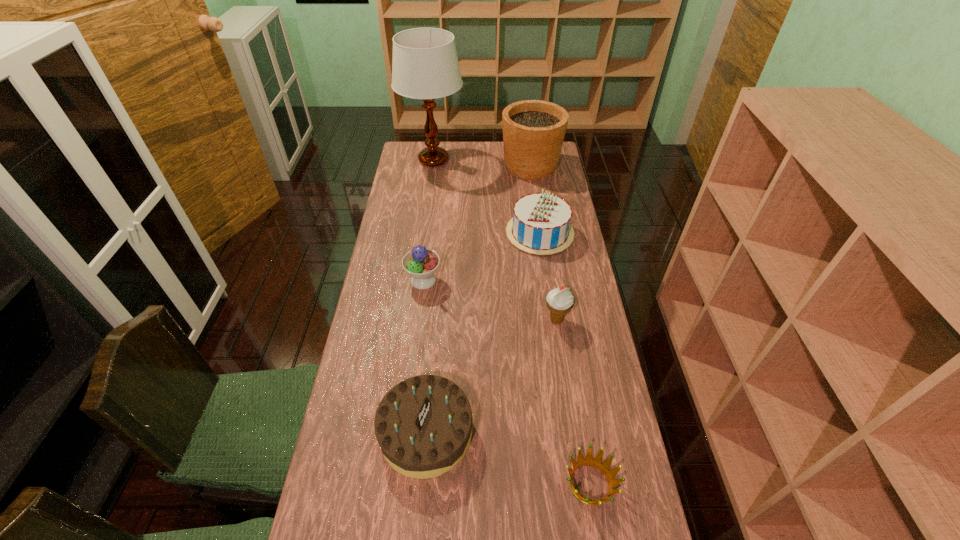
The height and width of the screenshot is (540, 960). I want to click on the shortest object, so click(x=596, y=462).

The height and width of the screenshot is (540, 960). Find the location of `blank area located 0.360m on the right of the tallest object`. blank area located 0.360m on the right of the tallest object is located at coordinates (540, 160).

This screenshot has height=540, width=960. What are the coordinates of `free space located 0.400m on the front of the second tallest object` in the screenshot? It's located at (541, 244).

Locate an element on the screen. The width and height of the screenshot is (960, 540). free space located on the front of the nearer icecream is located at coordinates (562, 352).

You are a GUI agent. You are given a task and a screenshot of the screen. Output one action in this format:
    pyautogui.click(x=<x>, y=<y>)
    Task: Click on the vacant area situated on the front of the left icecream
    
    Given the screenshot: What is the action you would take?
    pyautogui.click(x=416, y=345)

Image resolution: width=960 pixels, height=540 pixels. What are the coordinates of `free region located 0.280m on the back of the right birthday cake` in the screenshot? It's located at (531, 174).

The width and height of the screenshot is (960, 540). I want to click on vacant space located on the front-facing side of the left birthday cake, so click(x=499, y=433).

Locate an element on the screen. free location located on the left of the shortest object is located at coordinates (492, 483).

At what (x,y) coordinates should I click in order to perform the action: click on table lamp that is positioned at the far edge. Please return your answer as a coordinate pair (x, y). The image size is (960, 540). Looking at the image, I should click on (425, 65).

Locate an element on the screen. flowerpot that is positioned at the far edge is located at coordinates (533, 130).